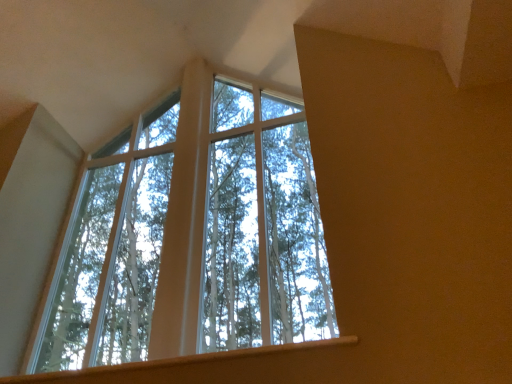
Question: Is clear glass window at center closer to the viewer compared to smooth wood window sill at lower center?

Choices:
 (A) no
 (B) yes

Answer: (A)

Question: Considering the relative sizes of clear glass window at center and smooth wood window sill at lower center in the image provided, is clear glass window at center bigger than smooth wood window sill at lower center?

Choices:
 (A) no
 (B) yes

Answer: (B)

Question: From a real-world perspective, is clear glass window at center located higher than smooth wood window sill at lower center?

Choices:
 (A) yes
 (B) no

Answer: (A)

Question: Considering the relative sizes of clear glass window at center and smooth wood window sill at lower center in the image provided, is clear glass window at center taller than smooth wood window sill at lower center?

Choices:
 (A) yes
 (B) no

Answer: (A)

Question: Is smooth wood window sill at lower center located within clear glass window at center?

Choices:
 (A) yes
 (B) no

Answer: (B)

Question: Is clear glass window at center wider than smooth wood window sill at lower center?

Choices:
 (A) yes
 (B) no

Answer: (B)

Question: Considering the relative sizes of smooth wood window sill at lower center and clear glass window at center in the image provided, is smooth wood window sill at lower center shorter than clear glass window at center?

Choices:
 (A) no
 (B) yes

Answer: (B)

Question: From a real-world perspective, does smooth wood window sill at lower center stand above clear glass window at center?

Choices:
 (A) yes
 (B) no

Answer: (B)

Question: Is smooth wood window sill at lower center at the left side of clear glass window at center?

Choices:
 (A) yes
 (B) no

Answer: (B)

Question: Is smooth wood window sill at lower center not within clear glass window at center?

Choices:
 (A) no
 (B) yes

Answer: (B)

Question: Does smooth wood window sill at lower center lie in front of clear glass window at center?

Choices:
 (A) no
 (B) yes

Answer: (B)

Question: Does smooth wood window sill at lower center appear on the right side of clear glass window at center?

Choices:
 (A) yes
 (B) no

Answer: (A)

Question: Is clear glass window at center bigger or smaller than smooth wood window sill at lower center?

Choices:
 (A) small
 (B) big

Answer: (B)